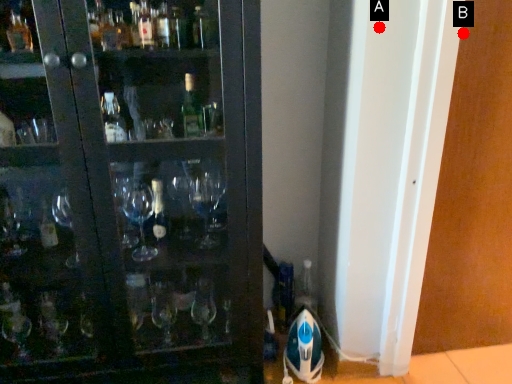
Question: Two points are circled on the image, labeled by A and B beside each circle. Among these points, which one is nearest to the camera?

Choices:
 (A) A is closer
 (B) B is closer

Answer: (A)